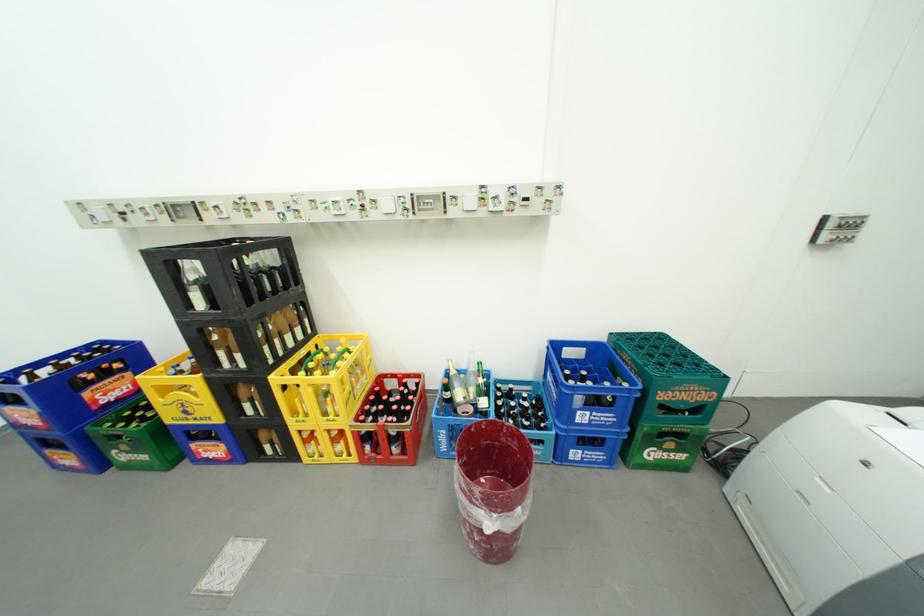
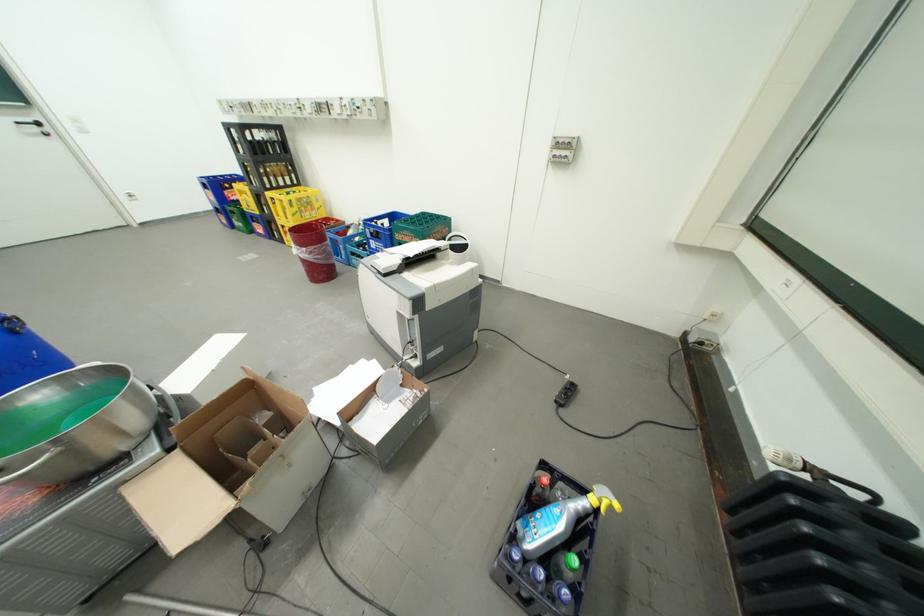
Find the pixel in the second image that matches point 362,395 in the first image.

(310, 215)